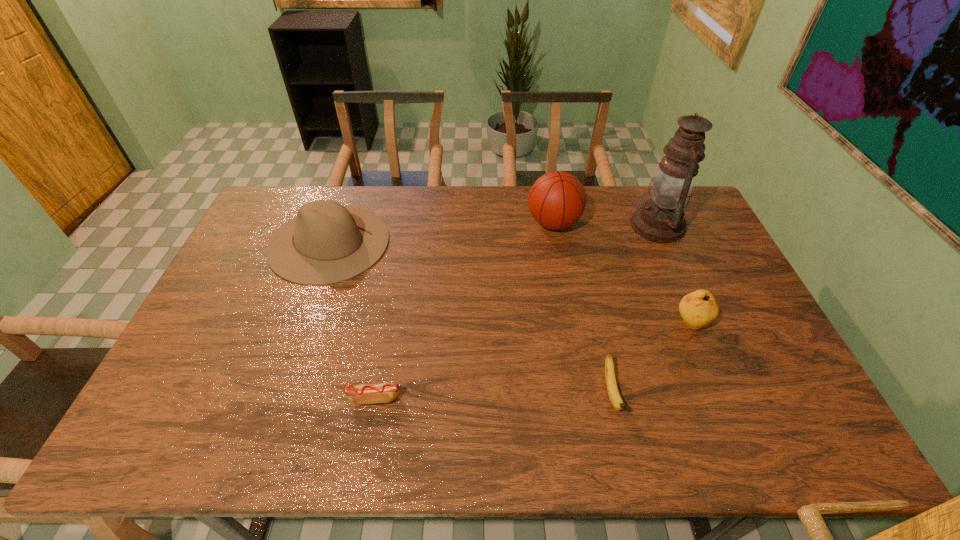
Find the location of a particular element. oil lamp is located at coordinates (661, 219).

You are a GUI agent. You are given a task and a screenshot of the screen. Output one action in this format:
    pyautogui.click(x=<x>, y=<y>)
    Task: Click on the basketball
    This screenshot has height=540, width=960.
    Given the screenshot: What is the action you would take?
    (x=557, y=200)

I want to click on sombrero, so click(322, 245).

At what (x,y) coordinates should I click in order to perform the action: click on pear. Please return your answer as a coordinate pair (x, y). The image size is (960, 540). Looking at the image, I should click on (698, 309).

Find the location of `the fifth tallest object`. the fifth tallest object is located at coordinates (614, 396).

Find the location of `sausage`. sausage is located at coordinates (385, 392).

The image size is (960, 540). Find the location of `vacant region located 0.360m on the front of the oil lamp`. vacant region located 0.360m on the front of the oil lamp is located at coordinates (706, 335).

Where is `blank area located 0.110m on the front of the second tallest object`? blank area located 0.110m on the front of the second tallest object is located at coordinates (561, 265).

Where is `free space located on the front of the sombrero`? free space located on the front of the sombrero is located at coordinates (285, 364).

Where is `free space located 0.150m on the back of the pear`? free space located 0.150m on the back of the pear is located at coordinates (670, 273).